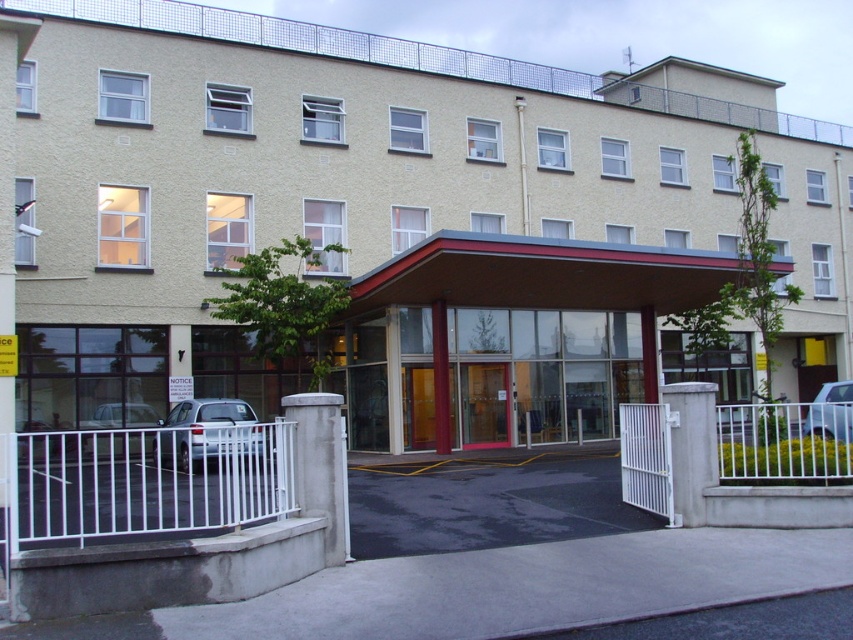
You are a delivery person trying to park your white metallic car at center in front of the wooden door at center. Can you park it without blocking the door?

The wooden door at center is thinner than the white metallic car at center, so parking the car directly in front of the door would block it. Choose a different parking spot to avoid blocking the entrance.

You are standing in front of the entrance of the building. You need to enter the building through the wooden door at center. Is the silver metallic car at left blocking your path to the door?

The wooden door at center is further to the viewer than the silver metallic car at left, so the car is behind the door and not blocking the path.

You are a delivery person arriving at the hospital entrance. You need to park your satin silver car at lower left as close as possible to the matte glass entrance at center without blocking the entrance. Can you park the car in front of the entrance?

The satin silver car at lower left is behind matte glass entrance at center, so it cannot be parked in front of the entrance as it is already positioned behind it.